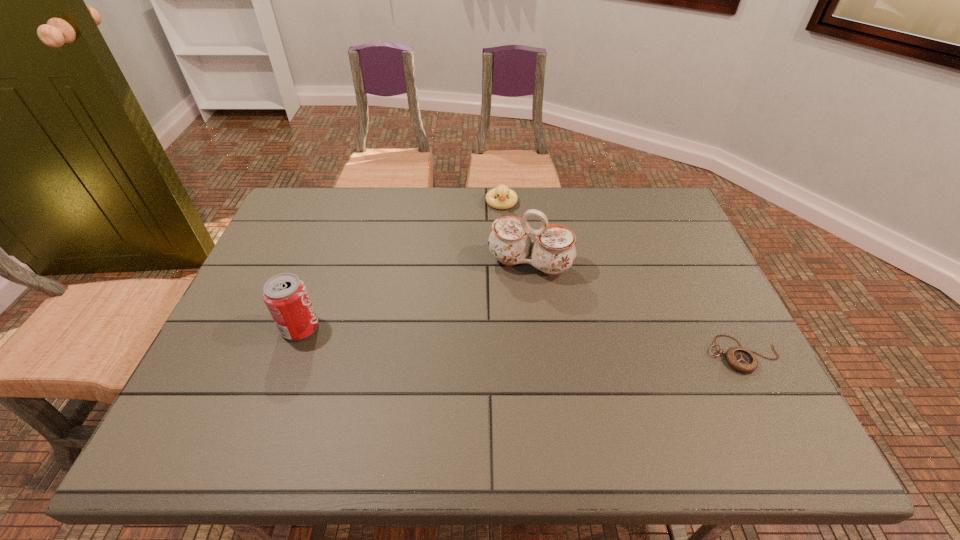
At what (x,y) coordinates should I click in order to perform the action: click on vacant space located at the beak of the second shortest object. Please return your answer as a coordinate pair (x, y). The height and width of the screenshot is (540, 960). Looking at the image, I should click on [505, 307].

This screenshot has width=960, height=540. Find the location of `vacant region located at the beak of the second shortest object`. vacant region located at the beak of the second shortest object is located at coordinates (504, 266).

This screenshot has width=960, height=540. I want to click on free point located 0.090m by the handle of the third nearest object, so click(x=509, y=307).

The image size is (960, 540). What are the coordinates of `vacant point located by the handle of the third nearest object` in the screenshot? It's located at (493, 347).

The width and height of the screenshot is (960, 540). Find the location of `free location located 0.100m by the handle of the third nearest object`. free location located 0.100m by the handle of the third nearest object is located at coordinates (508, 310).

Image resolution: width=960 pixels, height=540 pixels. I want to click on object present at the far edge, so click(x=502, y=191).

Where is `object at the near edge`? object at the near edge is located at coordinates (741, 359).

Identify the location of object that is at the left edge. (285, 295).

Where is `object located at the right edge`? object located at the right edge is located at coordinates (741, 359).

Locate an element on the screen. object that is at the near right corner is located at coordinates (741, 359).